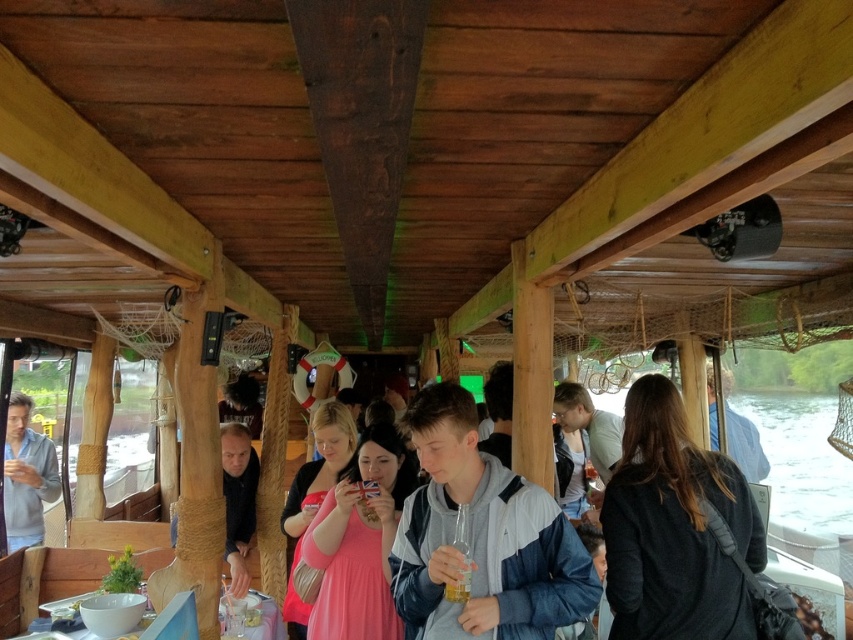
Is pink fabric dress at center positioned behind light blue fabric jacket at left?

No, it is in front of light blue fabric jacket at left.

From the picture: Between pink fabric dress at center and light blue fabric jacket at left, which one is positioned higher?

pink fabric dress at center is higher up.

Locate an element on the screen. pink fabric dress at center is located at coordinates click(x=358, y=541).

Can you confirm if dark gray fabric jacket at center is positioned to the right of dark blue shirt at center?

Correct, you'll find dark gray fabric jacket at center to the right of dark blue shirt at center.

Between dark gray fabric jacket at center and dark blue shirt at center, which one is positioned lower?

dark blue shirt at center

What are the coordinates of `dark gray fabric jacket at center` in the screenshot? It's located at (674, 529).

Between pink matte dress at center and light blue fabric jacket at left, which one is positioned higher?

pink matte dress at center is higher up.

This screenshot has height=640, width=853. I want to click on pink matte dress at center, so click(x=314, y=496).

The width and height of the screenshot is (853, 640). What do you see at coordinates (314, 496) in the screenshot? I see `pink matte dress at center` at bounding box center [314, 496].

The width and height of the screenshot is (853, 640). Identify the location of pink matte dress at center. (314, 496).